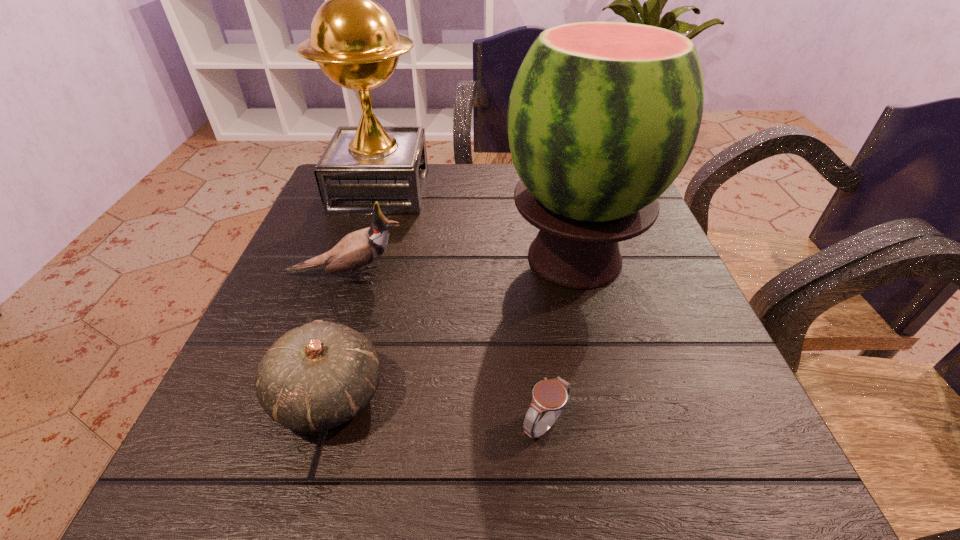
At what (x,y) coordinates should I click in order to perform the action: click on free space between the award and the second shortest object. Please return your answer as a coordinate pair (x, y). The width and height of the screenshot is (960, 540). Looking at the image, I should click on (354, 293).

You are a GUI agent. You are given a task and a screenshot of the screen. Output one action in this format:
    pyautogui.click(x=<x>, y=<y>)
    Task: Click on the free spot between the award and the gourd
    The image size is (960, 540).
    Given the screenshot: What is the action you would take?
    pyautogui.click(x=354, y=293)

Locate an element on the screen. free area in between the third shortest object and the watermelon is located at coordinates (460, 267).

Identify which object is the third nearest to the gourd. Please provide its 2D coordinates. Your answer should be formatted as a tuple, i.e. [(x, y)], where the tuple contains the x and y coordinates of a point satisfying the conditions above.

[(602, 117)]

This screenshot has height=540, width=960. Find the location of `object that stands as the third closest to the third tallest object`. object that stands as the third closest to the third tallest object is located at coordinates (602, 117).

What are the coordinates of `free space that satisfies the following two spatial constraints: 1. on the back side of the watermelon; 2. on the front-facing side of the farthest object` in the screenshot? It's located at pyautogui.click(x=558, y=190).

Find the location of a particular element. The width and height of the screenshot is (960, 540). free space in the image that satisfies the following two spatial constraints: 1. on the front-facing side of the award; 2. on the right side of the watch is located at coordinates (305, 426).

Find the location of `vacant area in the image that satisfies the following two spatial constraints: 1. on the back side of the watermelon; 2. on the right side of the watch`. vacant area in the image that satisfies the following two spatial constraints: 1. on the back side of the watermelon; 2. on the right side of the watch is located at coordinates (525, 259).